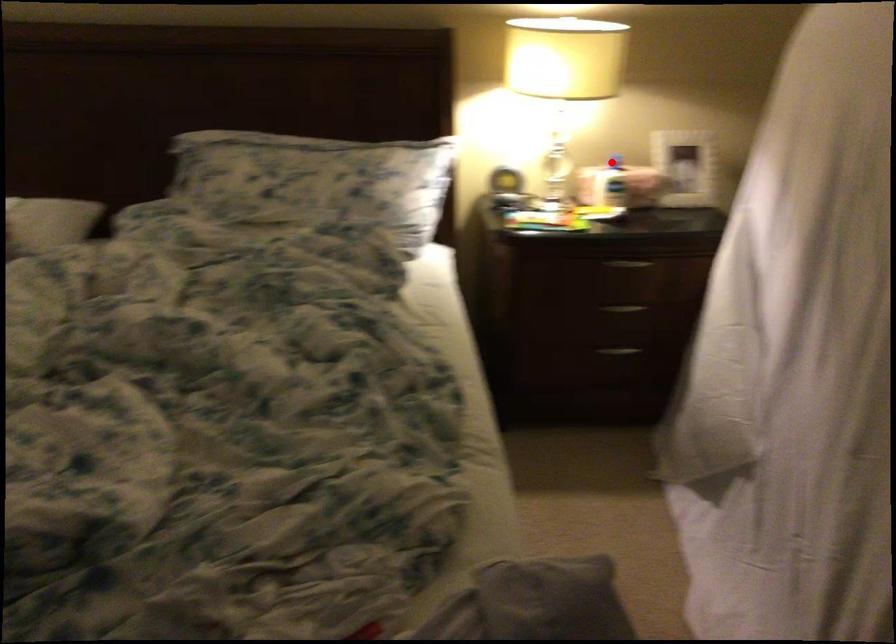
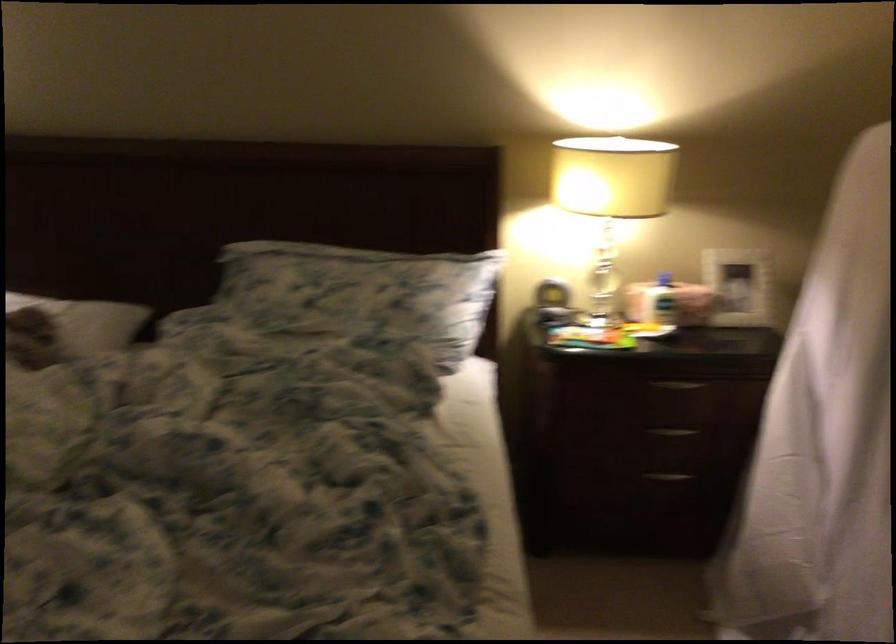
Locate, in the second image, the point that corresponds to the highlighted location in the first image.

(664, 279)